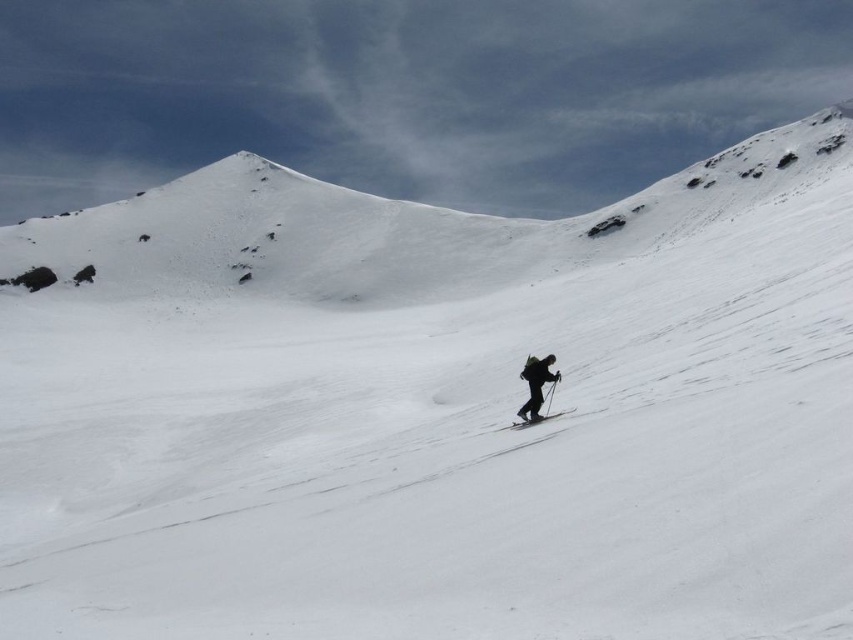
Can you confirm if white snow-covered mountain at upper center is shorter than black matte ski at center?

No.

Is white snow-covered mountain at upper center wider than black matte ski at center?

Correct, the width of white snow-covered mountain at upper center exceeds that of black matte ski at center.

I want to click on white snow-covered mountain at upper center, so click(x=392, y=228).

Is point (532, 356) more distant than point (537, 419)?

Yes, it is.

Who is positioned more to the left, black fabric backpack at center or black matte ski at center?

black matte ski at center

Who is more forward, (529, 385) or (524, 422)?

Positioned in front is point (524, 422).

You are a GUI agent. You are given a task and a screenshot of the screen. Output one action in this format:
    pyautogui.click(x=<x>, y=<y>)
    Task: Click on the black fabric backpack at center
    
    Given the screenshot: What is the action you would take?
    pos(537,385)

Is black matte snowboarder at center below black matte ski at center?

No, black matte snowboarder at center is not below black matte ski at center.

Is the position of black matte snowboarder at center less distant than that of black matte ski at center?

Yes, black matte snowboarder at center is in front of black matte ski at center.

This screenshot has width=853, height=640. I want to click on black matte snowboarder at center, so click(x=535, y=387).